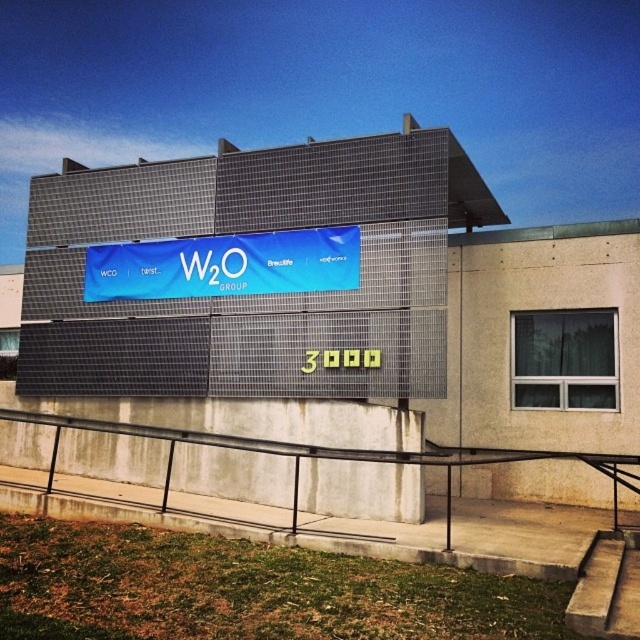
Question: Does black metal railing at lower center appear over blue fabric banner at center?

Choices:
 (A) yes
 (B) no

Answer: (B)

Question: Observing the image, what is the correct spatial positioning of black metal railing at lower center in reference to blue fabric banner at center?

Choices:
 (A) above
 (B) below

Answer: (B)

Question: Which of the following is the farthest from the observer?

Choices:
 (A) (333, 262)
 (B) (257, 452)

Answer: (B)

Question: Where is black metal railing at lower center located in relation to blue fabric banner at center in the image?

Choices:
 (A) above
 (B) below

Answer: (B)

Question: Among these points, which one is farthest from the camera?

Choices:
 (A) (493, 531)
 (B) (317, 236)

Answer: (B)